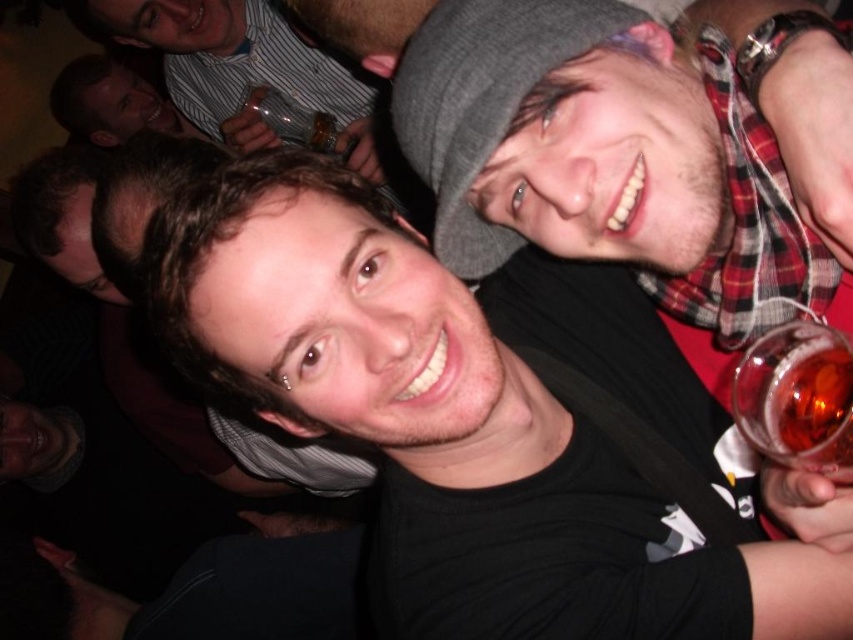
You are a photographer trying to capture the perfect shot of the black matte shirt at center. The camera you are using has a focus point at coordinate point (465,413). Will the black matte shirt at center be in focus?

The black matte shirt at center is located at point (465,413), so yes, the black matte shirt at center will be in focus because the focus point matches its location.